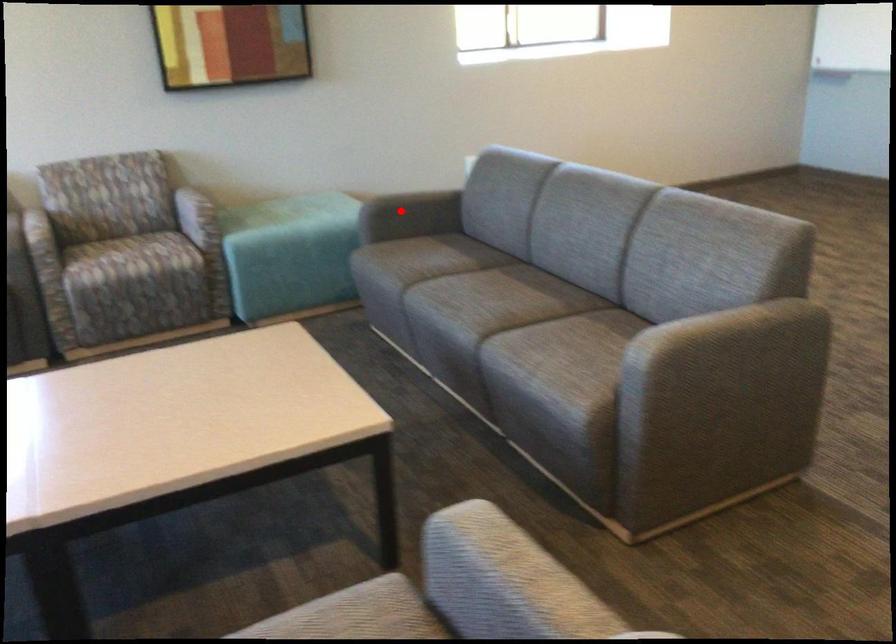
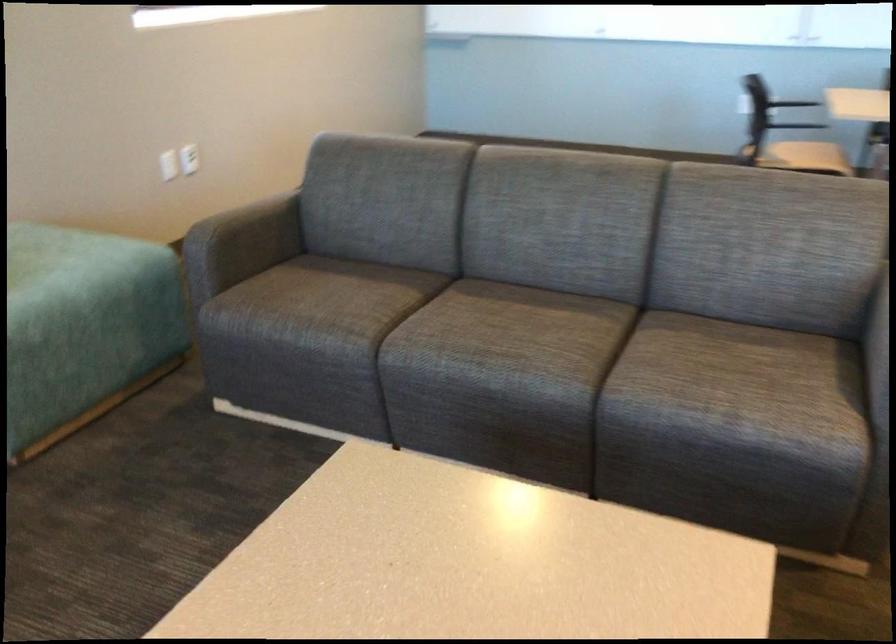
In the second image, find the point that corresponds to the highlighted location in the first image.

(243, 240)